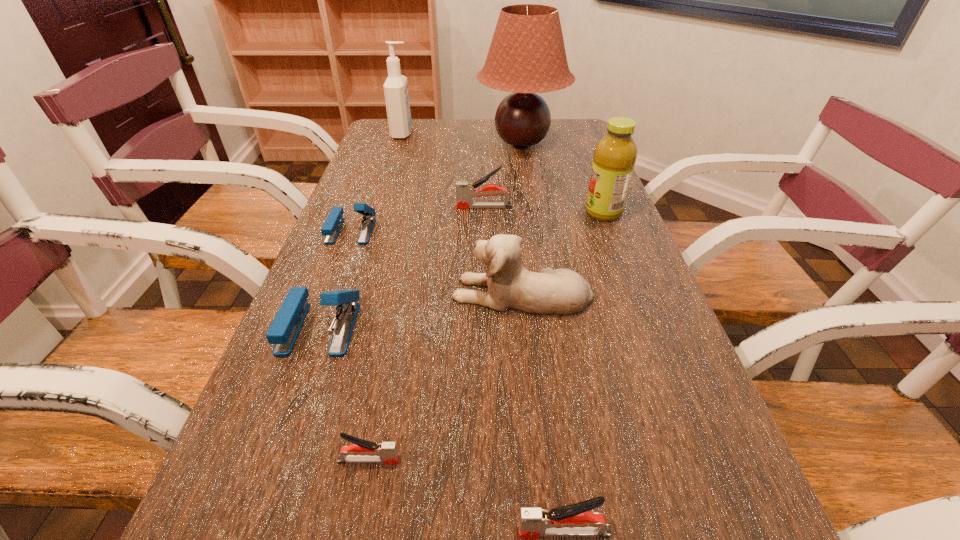
The image size is (960, 540). Identify the location of the tallest object. (527, 55).

Identify the location of brown lampshade. This screenshot has width=960, height=540. (527, 55).

This screenshot has height=540, width=960. Identify the location of cleansing agent. (396, 93).

You are a GUI agent. You are given a task and a screenshot of the screen. Output one action in this format:
    pyautogui.click(x=<x>, y=<y>)
    Task: Click on the third tallest object
    The width and height of the screenshot is (960, 540).
    Given the screenshot: What is the action you would take?
    pyautogui.click(x=615, y=155)

Find the location of a particular element. The image size is (960, 540). the fourth tallest object is located at coordinates (510, 285).

Where is `white puppy`? white puppy is located at coordinates [x=510, y=285].

At what (x,y) coordinates should I click in order to perform the action: click on the farthest stapler. Please return your answer as a coordinate pair (x, y). This screenshot has height=540, width=960. Looking at the image, I should click on (465, 191).

The image size is (960, 540). I want to click on the biggest gray stapler, so click(465, 191).

Find the location of a particular element. The width and height of the screenshot is (960, 540). the third nearest stapler is located at coordinates (283, 332).

I want to click on the nearer blue stapler, so click(283, 332).